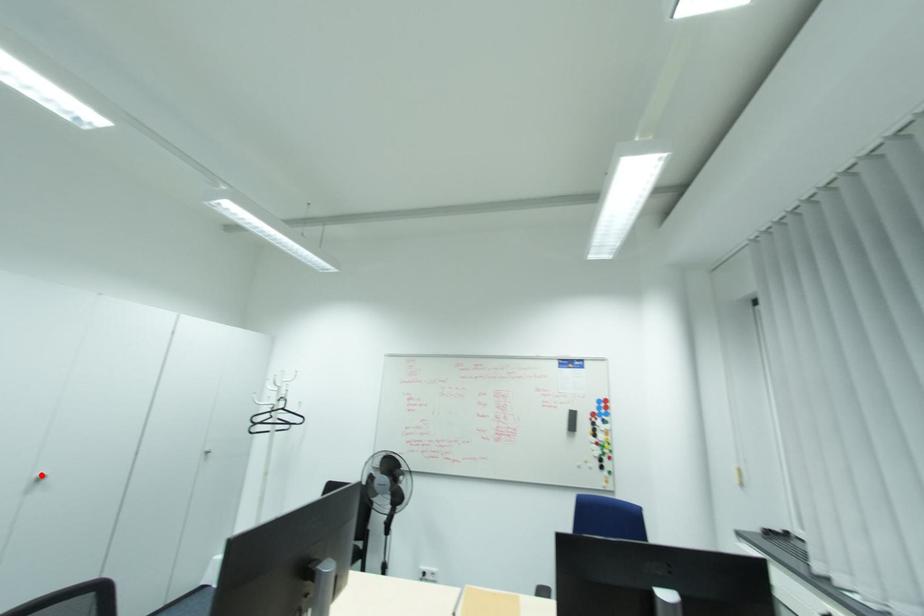
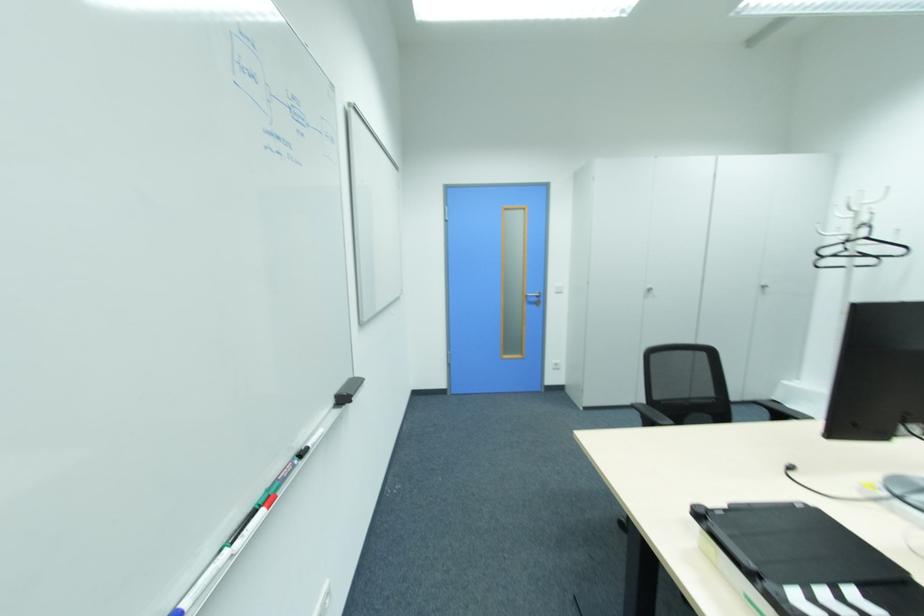
Question: I am providing you with two images of the same scene from different viewpoints. In image1, a red point is highlighted. Considering the same 3D point in image2, which of the following is correct?

Choices:
 (A) It is closer
 (B) It is farther

Answer: (B)